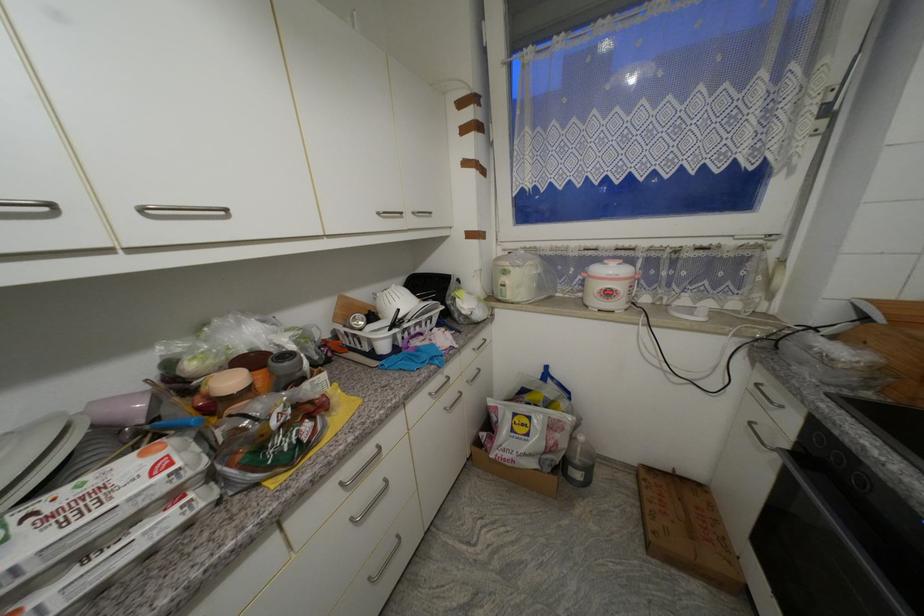
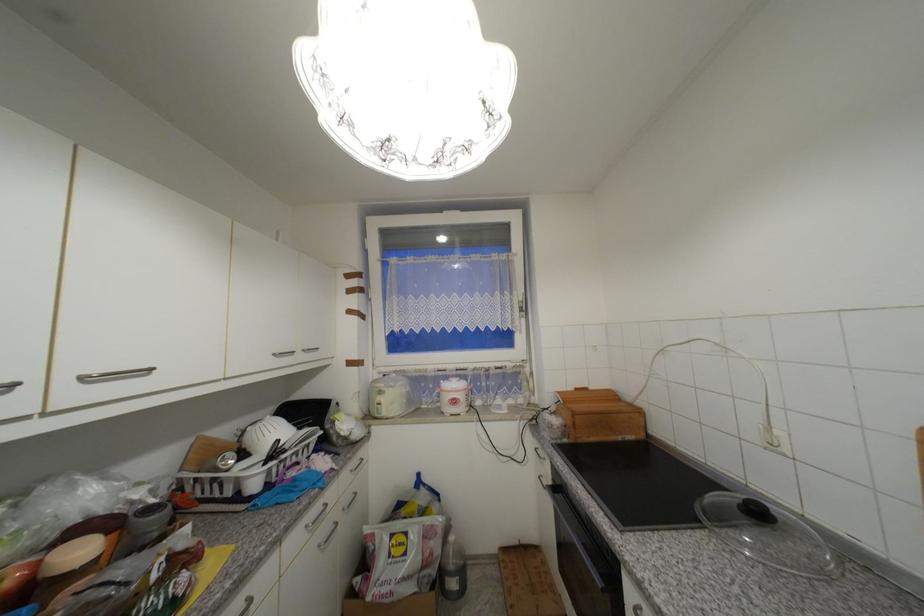
Locate, in the second image, the point that corresponds to point 59,208 in the first image.

(19, 386)